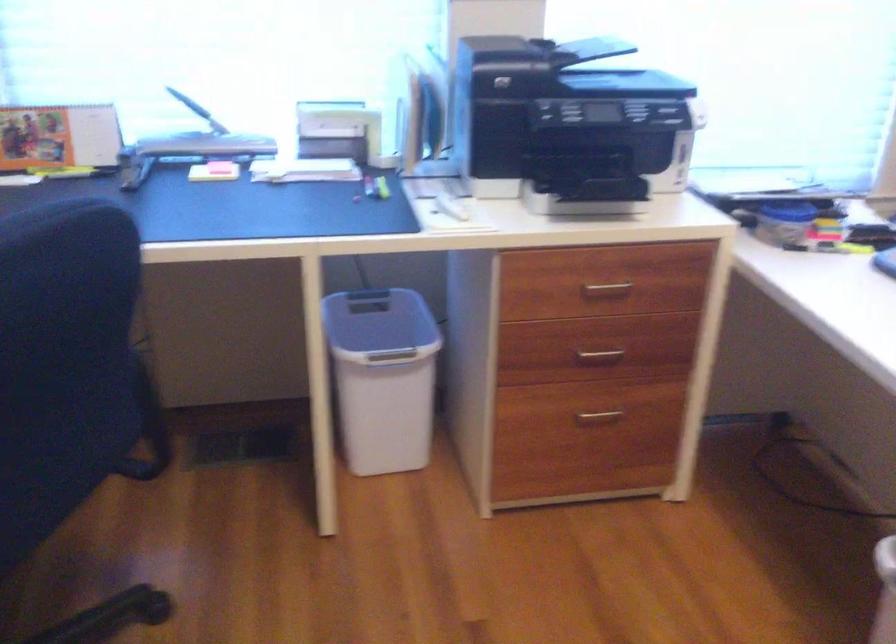
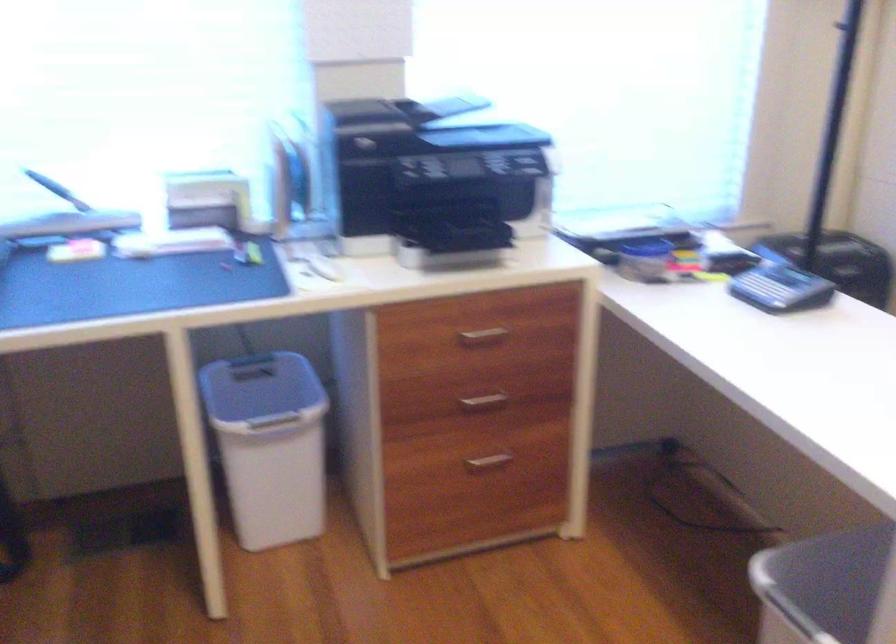
Find the pixel in the second image that matches [595,413] in the first image.

(487, 462)